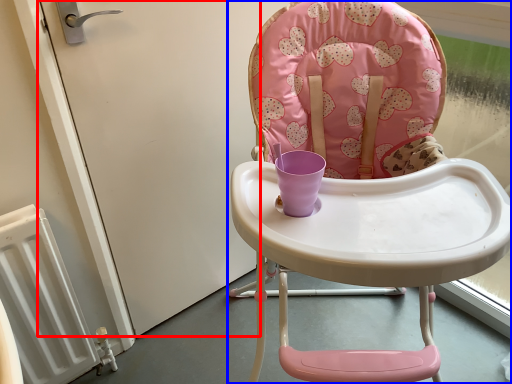
Question: Which object is further to the camera taking this photo, screen door (highlighted by a red box) or chair (highlighted by a blue box)?

Choices:
 (A) screen door
 (B) chair

Answer: (A)